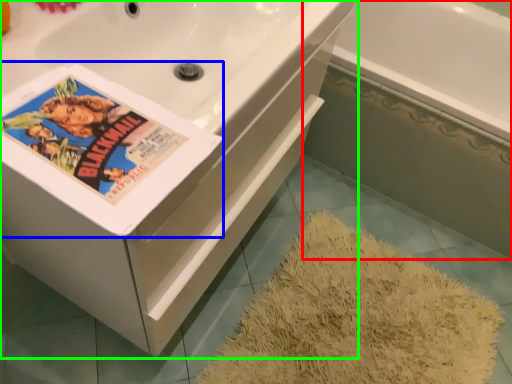
Question: Estimate the real-world distances between objects in this image. Which object is farther from bath (highlighted by a red box), paperback book (highlighted by a blue box) or bathtub (highlighted by a green box)?

Choices:
 (A) paperback book
 (B) bathtub

Answer: (A)